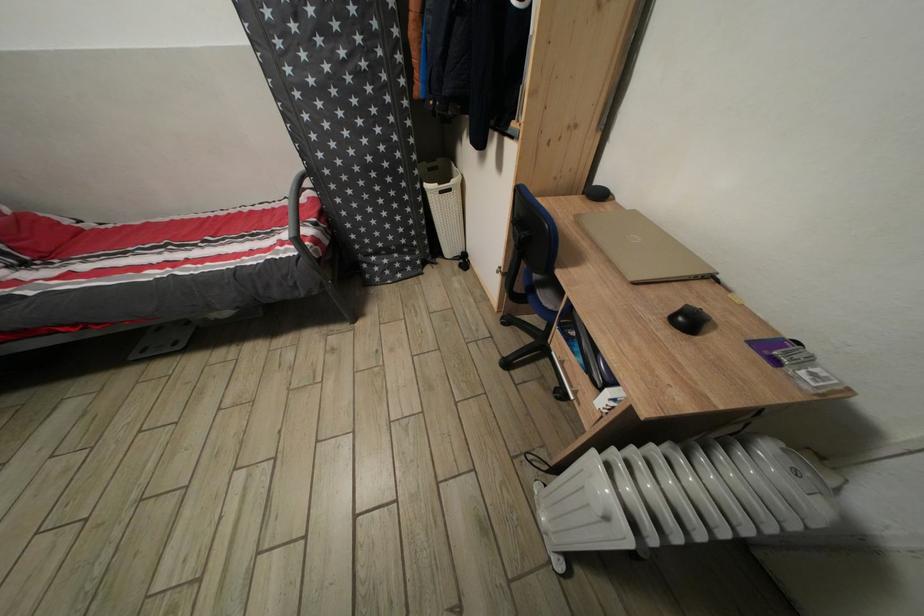
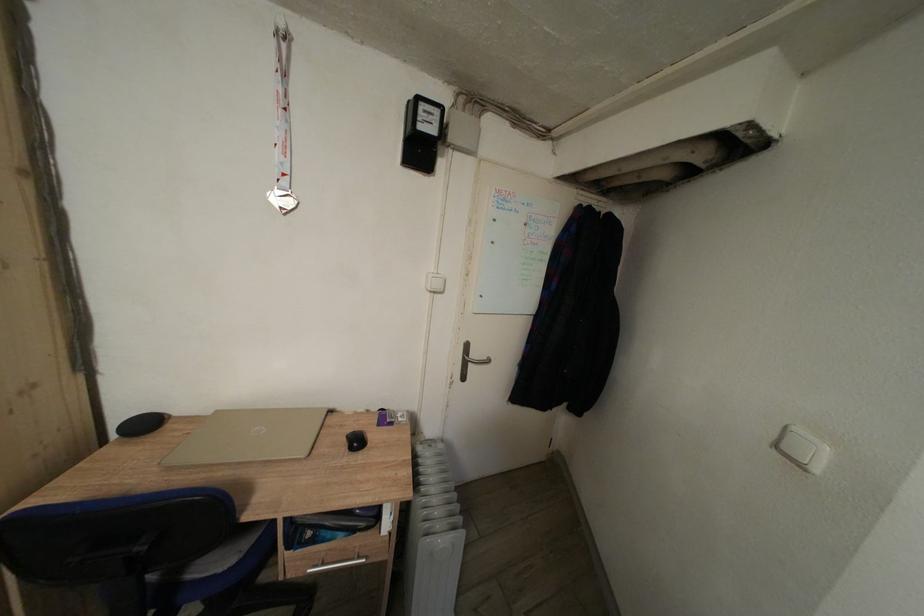
Question: The camera is either moving clockwise (left) or counter-clockwise (right) around the object. The first image is from the beginning of the video and the second image is from the end. Is the camera moving left or right when shooting the video?

Choices:
 (A) Left
 (B) Right

Answer: (A)